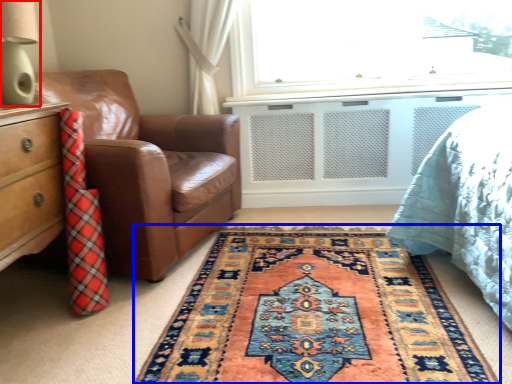
Question: Which object appears farthest to the camera in this image, table lamp (highlighted by a red box) or mat (highlighted by a blue box)?

Choices:
 (A) table lamp
 (B) mat

Answer: (A)